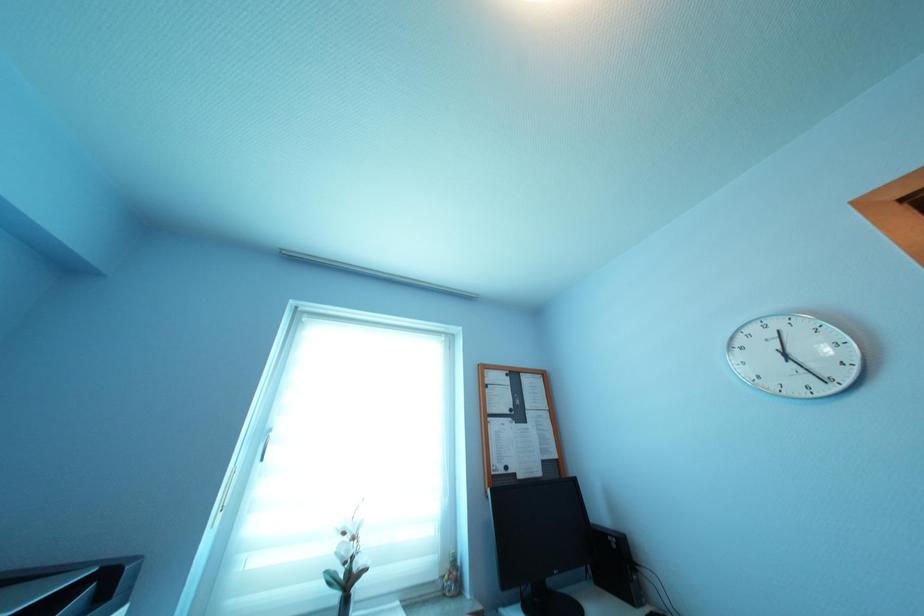
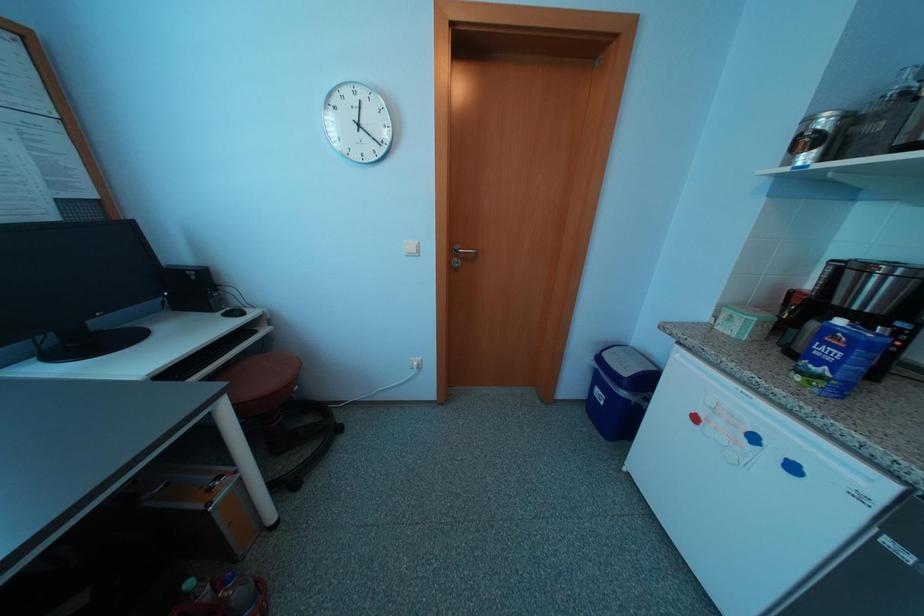
The images are taken continuously from a first-person perspective. In which direction is your viewpoint rotating?

The rotation direction of the camera is right-down.